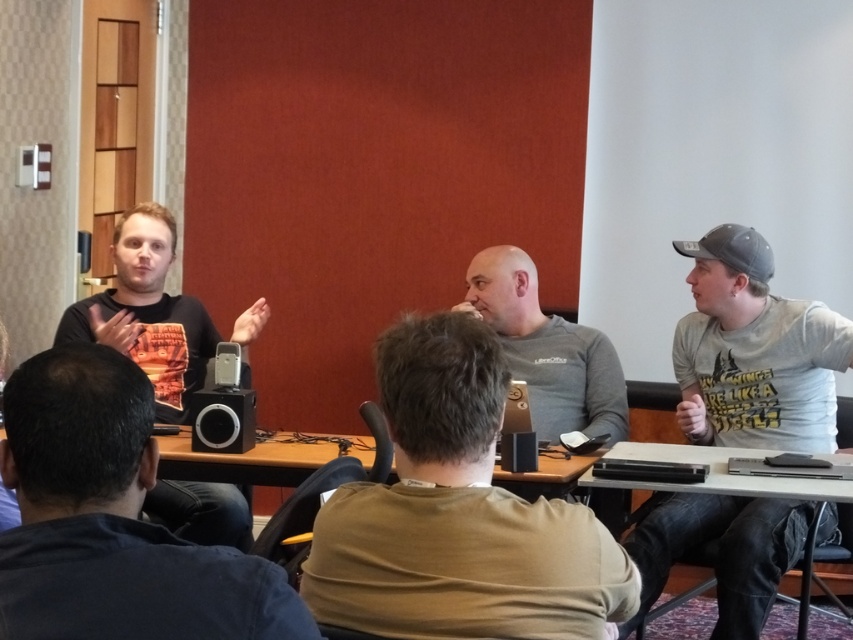
You are standing at the front of the room where the matte black shirt at left is located. You need to pass a document to someone who is 3.31 meters away. Do you think you can throw it directly without needing to walk closer?

The distance between you and the matte black shirt at left is 3.31 meters. Throwing a document that far might be difficult as it requires accuracy and strength. It is advisable to walk closer for a more reliable delivery.

Based on the scene description, where is the matte black shirt at left located in the image?

The matte black shirt at left is located at point 0.489 on the x axis and 0.174 on the y axis.